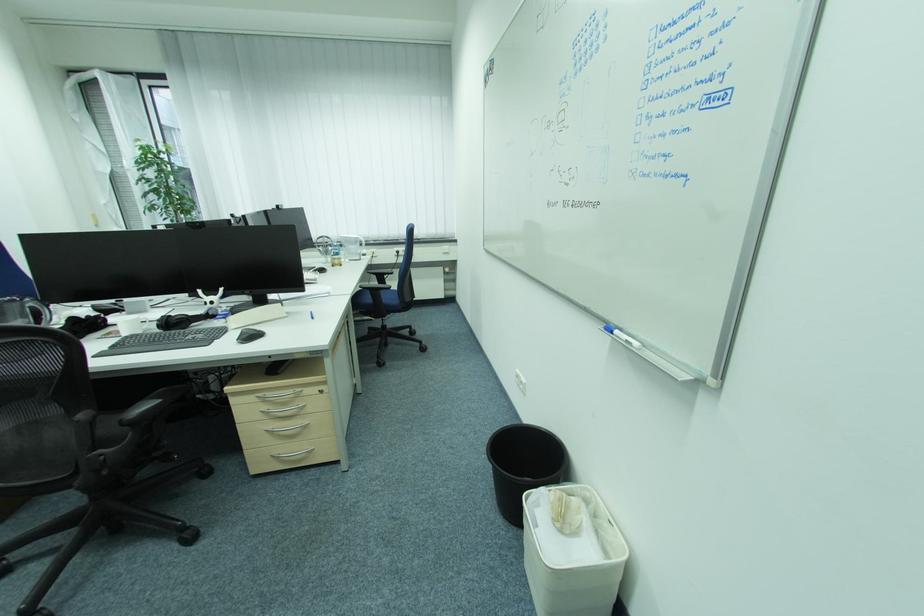
The height and width of the screenshot is (616, 924). Describe the element at coordinates (76, 448) in the screenshot. I see `a chair sitting surface` at that location.